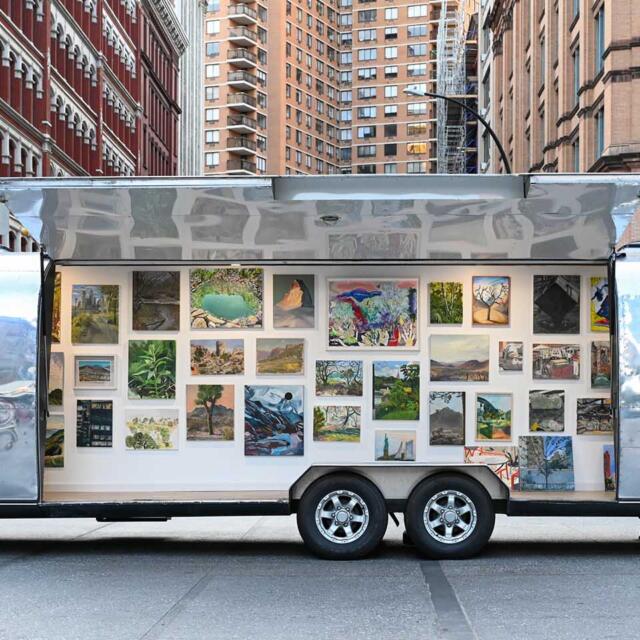
What are the coordinates of `green plant` in the screenshot? It's located at (153, 361).